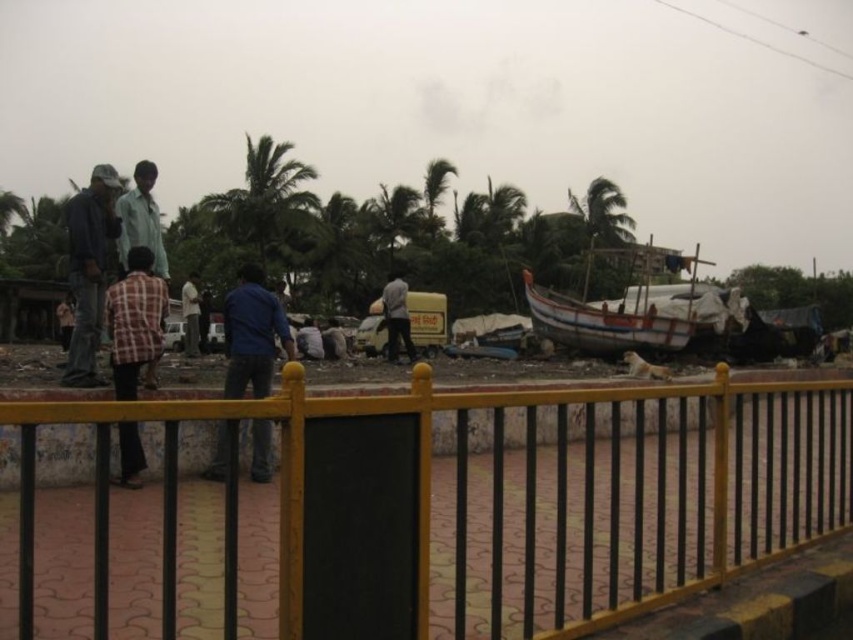
Question: Observing the image, what is the correct spatial positioning of yellow metal fence at center in reference to dark blue jeans at center?

Choices:
 (A) left
 (B) right

Answer: (B)

Question: Which object appears farthest from the camera in this image?

Choices:
 (A) dark blue jeans at center
 (B) plaid fabric shirt at lower left
 (C) dark blue jeans at left

Answer: (A)

Question: Considering the real-world distances, which object is closest to the wooden boat at center?

Choices:
 (A) dark blue jeans at left
 (B) yellow metal fence at center

Answer: (B)

Question: Is wooden boat at center wider than dark blue jeans at left?

Choices:
 (A) no
 (B) yes

Answer: (B)

Question: Which point appears closest to the camera in this image?

Choices:
 (A) (216, 445)
 (B) (753, 547)
 (C) (645, 344)

Answer: (B)

Question: Is yellow metal fence at center bigger than dark blue jeans at left?

Choices:
 (A) yes
 (B) no

Answer: (A)